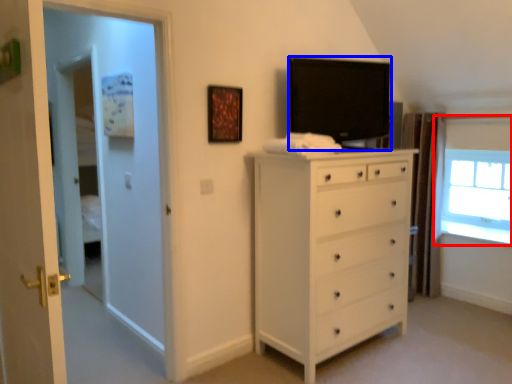
Question: Which of the following is the closest to the observer, window (highlighted by a red box) or television (highlighted by a blue box)?

Choices:
 (A) window
 (B) television

Answer: (B)